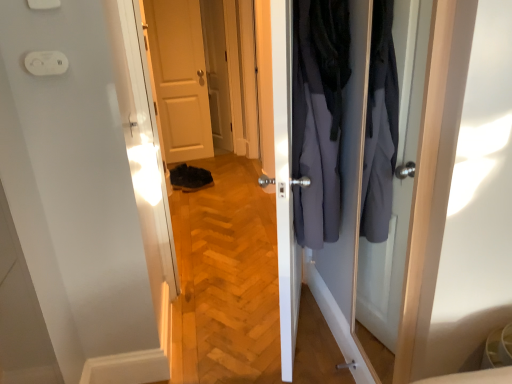
The width and height of the screenshot is (512, 384). Find the location of `vacant region below dark gray fabric coat at center (from a real-world perspective)`. vacant region below dark gray fabric coat at center (from a real-world perspective) is located at coordinates (310, 342).